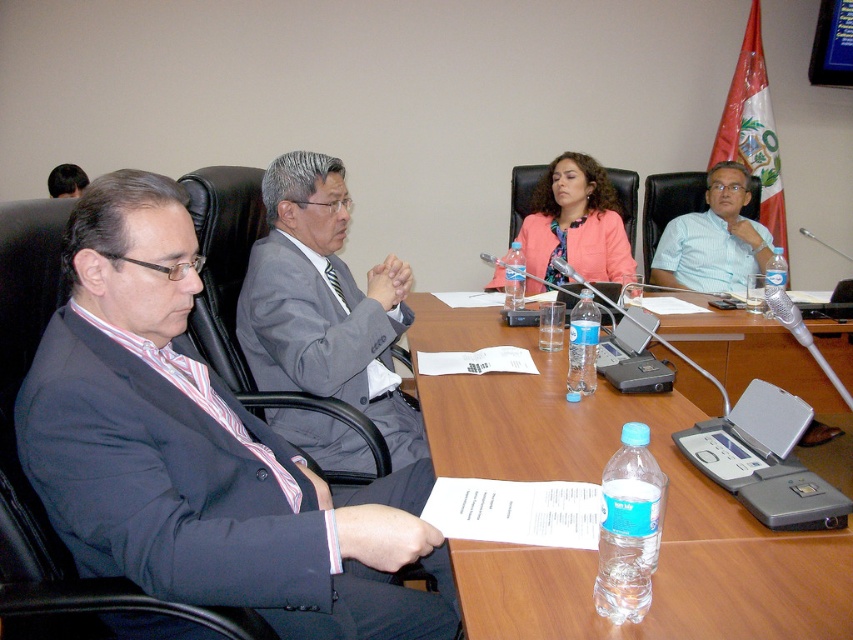
Question: Which object appears farthest from the camera in this image?

Choices:
 (A) matte black suit at left
 (B) light blue shirt at right
 (C) pink fabric jacket at upper center

Answer: (B)

Question: Can you confirm if gray suit at center is wider than clear plastic water bottle at center?

Choices:
 (A) no
 (B) yes

Answer: (B)

Question: Among these objects, which one is nearest to the camera?

Choices:
 (A) clear plastic water bottle at center
 (B) light blue shirt at right

Answer: (A)

Question: Is gray suit at center thinner than dark brown hair at upper left?

Choices:
 (A) yes
 (B) no

Answer: (B)

Question: In this image, where is pink fabric jacket at upper center located relative to dark brown hair at upper left?

Choices:
 (A) right
 (B) left

Answer: (A)

Question: Which object is positioned farthest from the gray suit at center?

Choices:
 (A) clear wood table at center
 (B) dark brown hair at upper left

Answer: (B)